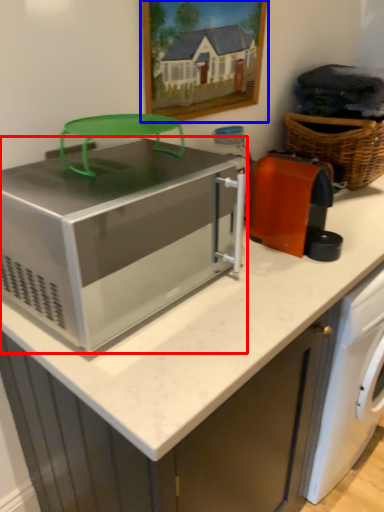
Question: Which object appears closest to the camera in this image, home appliance (highlighted by a red box) or picture frame (highlighted by a blue box)?

Choices:
 (A) home appliance
 (B) picture frame

Answer: (A)